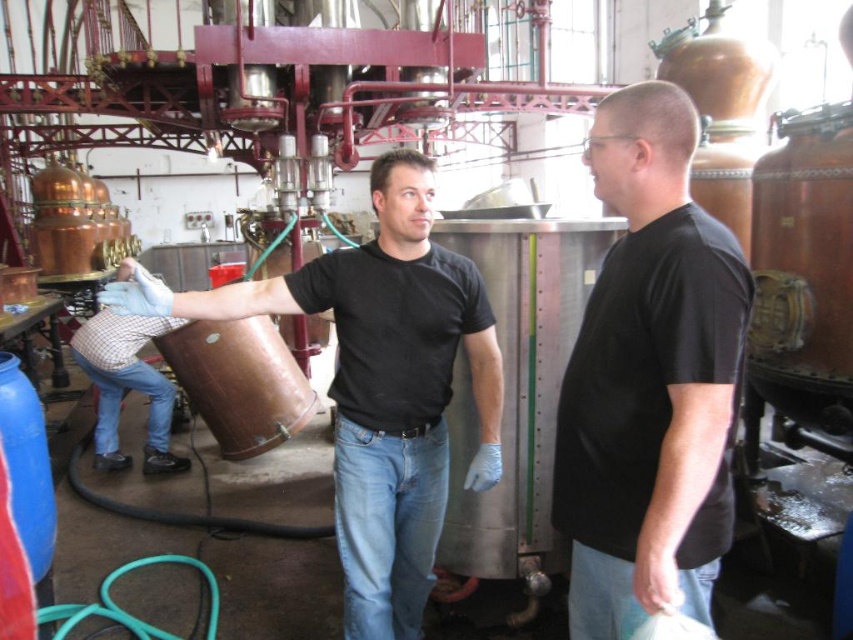
You are a visitor in the distillery and need to locate the person wearing the black matte shirt at center. According to the coordinates provided, where exactly would you find this person in the image?

The black matte shirt at center is located at point coordinates of (650, 380).

You are standing at the point marked as point (x=619, y=424) in this industrial distillery. You need to move to the nearest emergency exit, which is located 10 feet away from your current position. Can you safely walk straight from your current position to reach the exit without encountering any obstacles?

The distance between you and the viewer is 5.59 feet, but the emergency exit is 10 feet away. Since the exit is further than the distance to the viewer, you might need to adjust your path to reach it safely, possibly around any equipment or obstacles in the immediate area.

You are standing at the entrance of the distillery and see two points marked in the image. The first point is at coordinate point (691, 484) and the second is at point (422, 497). Which point is closer to you?

Point (691, 484) is in front of point (422, 497), so the first point is closer to you.